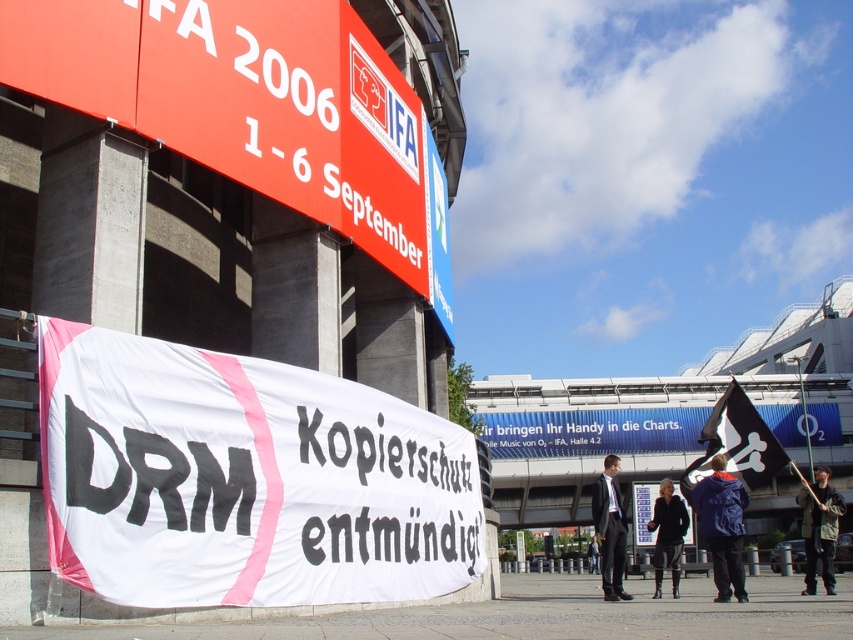
Who is positioned more to the right, white fabric banner at upper center or blue fabric jacket at lower right?

From the viewer's perspective, blue fabric jacket at lower right appears more on the right side.

Does white fabric banner at upper center lie behind blue fabric jacket at lower right?

That is False.

At what (x,y) coordinates should I click in order to perform the action: click on white fabric banner at upper center. Please return your answer as a coordinate pair (x, y). Image resolution: width=853 pixels, height=640 pixels. Looking at the image, I should click on (247, 100).

Does point (743, 394) come closer to viewer compared to point (686, 524)?

Yes, point (743, 394) is closer to viewer.

Who is lower down, black fabric flag at upper right or black leather jacket at center?

Positioned lower is black leather jacket at center.

Identify the location of black fabric flag at upper right. The width and height of the screenshot is (853, 640). (735, 442).

Consider the image. Between white fabric banner at center and white fabric banner at upper center, which one has less height?

Standing shorter between the two is white fabric banner at center.

Does point (367, 413) come in front of point (425, 243)?

Yes, point (367, 413) is in front of point (425, 243).

Which is behind, point (223, 362) or point (79, 38)?

Positioned behind is point (79, 38).

This screenshot has height=640, width=853. I want to click on white fabric banner at center, so click(244, 480).